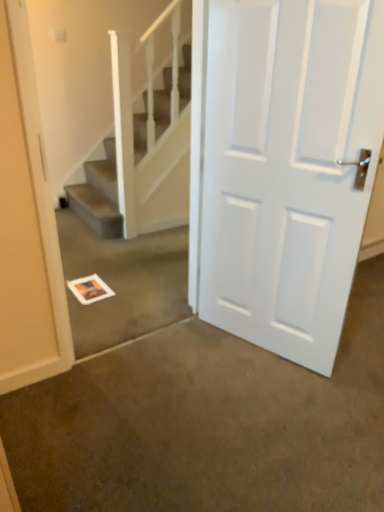
Question: Considering the relative positions of white paper at center and white textured stairs at upper center in the image provided, is white paper at center to the right of white textured stairs at upper center from the viewer's perspective?

Choices:
 (A) no
 (B) yes

Answer: (A)

Question: Is white paper at center oriented towards white textured stairs at upper center?

Choices:
 (A) no
 (B) yes

Answer: (A)

Question: Considering the relative sizes of white paper at center and white textured stairs at upper center in the image provided, is white paper at center wider than white textured stairs at upper center?

Choices:
 (A) yes
 (B) no

Answer: (A)

Question: Is white paper at center touching white textured stairs at upper center?

Choices:
 (A) yes
 (B) no

Answer: (B)

Question: Is white paper at center bigger than white textured stairs at upper center?

Choices:
 (A) no
 (B) yes

Answer: (A)

Question: From the image's perspective, is white textured stairs at upper center above or below white paper at center?

Choices:
 (A) below
 (B) above

Answer: (B)

Question: From a real-world perspective, relative to white paper at center, is white textured stairs at upper center vertically above or below?

Choices:
 (A) below
 (B) above

Answer: (B)

Question: Considering the positions of white textured stairs at upper center and white paper at center in the image, is white textured stairs at upper center bigger or smaller than white paper at center?

Choices:
 (A) big
 (B) small

Answer: (A)

Question: Considering their positions, is white textured stairs at upper center located in front of or behind white paper at center?

Choices:
 (A) behind
 (B) front

Answer: (A)

Question: Based on their sizes in the image, would you say white paper at center is bigger or smaller than white textured stairs at upper center?

Choices:
 (A) small
 (B) big

Answer: (A)

Question: Considering the positions of white paper at center and white textured stairs at upper center in the image, is white paper at center wider or thinner than white textured stairs at upper center?

Choices:
 (A) wide
 (B) thin

Answer: (A)

Question: From the image's perspective, is white paper at center positioned above or below white textured stairs at upper center?

Choices:
 (A) below
 (B) above

Answer: (A)

Question: Which is correct: white paper at center is inside white textured stairs at upper center, or outside of it?

Choices:
 (A) outside
 (B) inside

Answer: (A)

Question: Would you say white textured stairs at upper center is inside or outside white matte door at center?

Choices:
 (A) inside
 (B) outside

Answer: (B)

Question: Considering the relative positions of white textured stairs at upper center and white matte door at center in the image provided, is white textured stairs at upper center to the left or to the right of white matte door at center?

Choices:
 (A) left
 (B) right

Answer: (A)